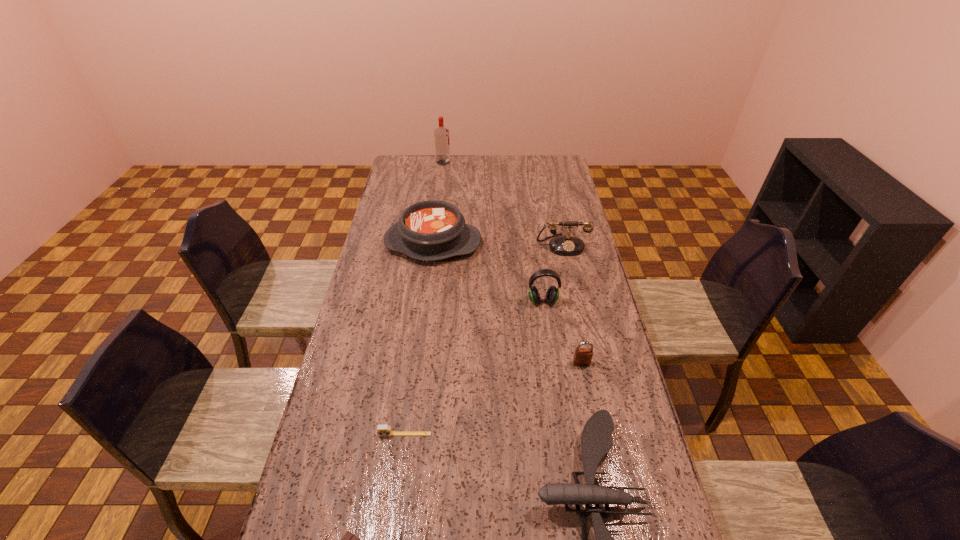
The image size is (960, 540). I want to click on empty space that is in between the tape measure and the padlock, so click(493, 399).

Locate which object is the fifth closest to the shortest object. Please provide its 2D coordinates. Your answer should be formatted as a tuple, i.e. [(x, y)], where the tuple contains the x and y coordinates of a point satisfying the conditions above.

[(431, 230)]

At what (x,y) coordinates should I click in order to perform the action: click on object that stands as the fourth closest to the chocolate bar. Please return your answer as a coordinate pair (x, y). This screenshot has width=960, height=540. Looking at the image, I should click on (552, 295).